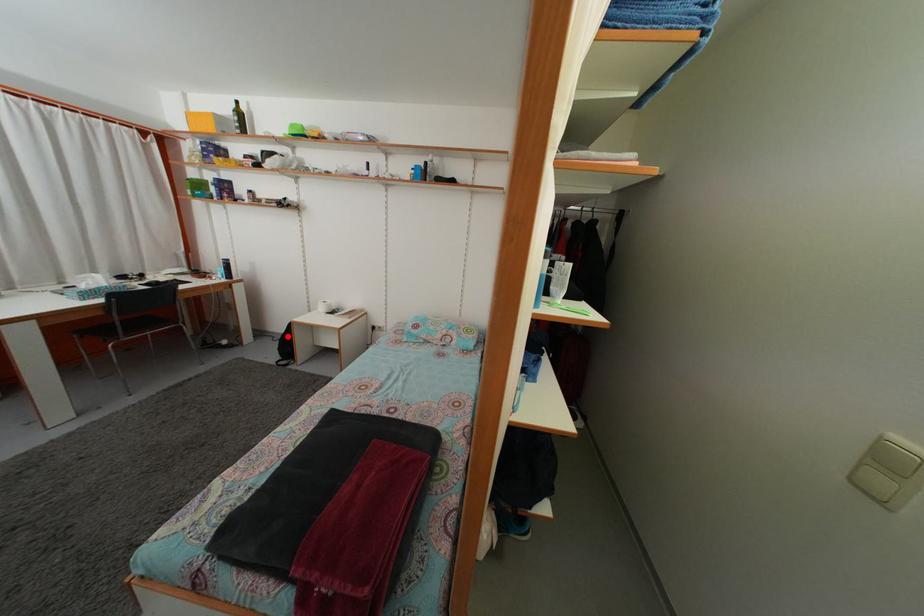
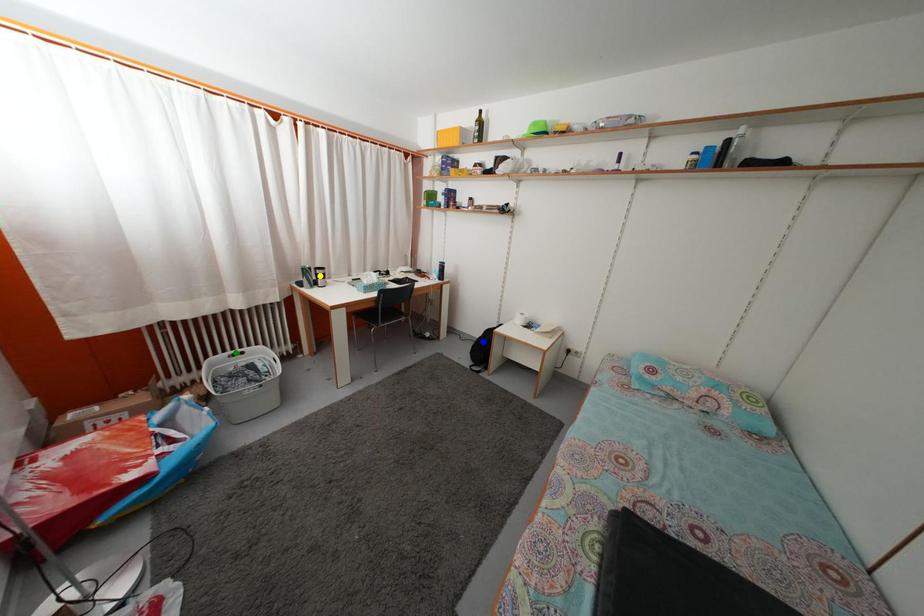
Question: I am providing you with two images of the same scene from different viewpoints. A red point is marked on the first image. You are given multiple points on the second image. Which point in image 2 represents the same 3d spot as the red point in image 1?

Choices:
 (A) green point
 (B) blue point
 (C) yellow point

Answer: (B)